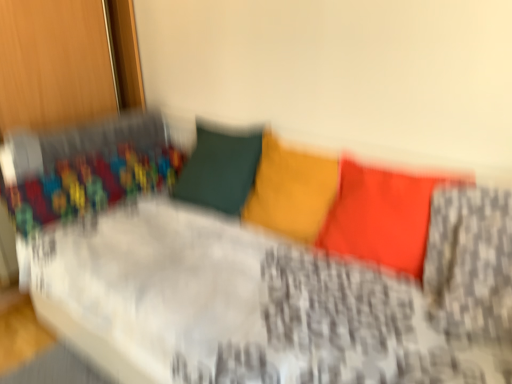
Describe the element at coordinates (291, 191) in the screenshot. I see `matte yellow pillow at center, which ranks as the second pillow in right-to-left order` at that location.

Identify the location of matte yellow pillow at center, placed as the 1th pillow when sorted from left to right. (291, 191).

In order to face matte yellow pillow at center, which ranks as the second pillow in right-to-left order, should I rotate leftwards or rightwards?

To face it directly, rotate right by 4.267 degrees.

In the scene shown: Measure the distance between matte orange pillow at center, the 1th pillow viewed from the right, and camera.

matte orange pillow at center, the 1th pillow viewed from the right, is 4.42 feet from camera.

The width and height of the screenshot is (512, 384). Describe the element at coordinates (382, 216) in the screenshot. I see `matte orange pillow at center, which is counted as the 2th pillow, starting from the left` at that location.

Where is `matte orange pillow at center, which is counted as the 2th pillow, starting from the left`? matte orange pillow at center, which is counted as the 2th pillow, starting from the left is located at coordinates (382, 216).

You are a GUI agent. You are given a task and a screenshot of the screen. Output one action in this format:
    pyautogui.click(x=<x>, y=<y>)
    Task: Click on the matte yellow pillow at center, placed as the 1th pillow when sorted from left to right
    The height and width of the screenshot is (384, 512).
    Given the screenshot: What is the action you would take?
    pyautogui.click(x=291, y=191)

Can you confirm if matte orange pillow at center, the 1th pillow viewed from the right, is positioned to the right of matte yellow pillow at center, placed as the 1th pillow when sorted from left to right?

Correct, you'll find matte orange pillow at center, the 1th pillow viewed from the right, to the right of matte yellow pillow at center, placed as the 1th pillow when sorted from left to right.

Considering the positions of objects matte orange pillow at center, the 1th pillow viewed from the right, and matte yellow pillow at center, placed as the 1th pillow when sorted from left to right, in the image provided, who is behind, matte orange pillow at center, the 1th pillow viewed from the right, or matte yellow pillow at center, placed as the 1th pillow when sorted from left to right,?

matte yellow pillow at center, placed as the 1th pillow when sorted from left to right, is further from the camera.

Which is closer to the camera, (372, 219) or (335, 158)?

Clearly, point (372, 219) is closer to the camera than point (335, 158).

From the image's perspective, is matte orange pillow at center, which is counted as the 2th pillow, starting from the left, over matte yellow pillow at center, placed as the 1th pillow when sorted from left to right?

No, from the image's perspective, matte orange pillow at center, which is counted as the 2th pillow, starting from the left, is not above matte yellow pillow at center, placed as the 1th pillow when sorted from left to right.

From a real-world perspective, which object stands above the other?

matte orange pillow at center, which is counted as the 2th pillow, starting from the left, is physically above.

Considering the sizes of matte orange pillow at center, which is counted as the 2th pillow, starting from the left, and matte yellow pillow at center, placed as the 1th pillow when sorted from left to right, in the image, is matte orange pillow at center, which is counted as the 2th pillow, starting from the left, wider or thinner than matte yellow pillow at center, placed as the 1th pillow when sorted from left to right,?

Clearly, matte orange pillow at center, which is counted as the 2th pillow, starting from the left, has less width compared to matte yellow pillow at center, placed as the 1th pillow when sorted from left to right.

Considering the sizes of matte orange pillow at center, which is counted as the 2th pillow, starting from the left, and matte yellow pillow at center, which ranks as the second pillow in right-to-left order, in the image, is matte orange pillow at center, which is counted as the 2th pillow, starting from the left, taller or shorter than matte yellow pillow at center, which ranks as the second pillow in right-to-left order,?

Considering their sizes, matte orange pillow at center, which is counted as the 2th pillow, starting from the left, has more height than matte yellow pillow at center, which ranks as the second pillow in right-to-left order.

Considering the sizes of objects matte orange pillow at center, which is counted as the 2th pillow, starting from the left, and matte yellow pillow at center, placed as the 1th pillow when sorted from left to right, in the image provided, who is bigger, matte orange pillow at center, which is counted as the 2th pillow, starting from the left, or matte yellow pillow at center, placed as the 1th pillow when sorted from left to right,?

With larger size is matte orange pillow at center, which is counted as the 2th pillow, starting from the left.

Is matte orange pillow at center, the 1th pillow viewed from the right, not within matte yellow pillow at center, placed as the 1th pillow when sorted from left to right?

matte orange pillow at center, the 1th pillow viewed from the right, lies outside matte yellow pillow at center, placed as the 1th pillow when sorted from left to right,'s area.

Does matte orange pillow at center, which is counted as the 2th pillow, starting from the left, touch matte yellow pillow at center, which ranks as the second pillow in right-to-left order?

No, matte orange pillow at center, which is counted as the 2th pillow, starting from the left, is not touching matte yellow pillow at center, which ranks as the second pillow in right-to-left order.

Could you tell me if matte orange pillow at center, which is counted as the 2th pillow, starting from the left, is turned towards matte yellow pillow at center, placed as the 1th pillow when sorted from left to right?

No, matte orange pillow at center, which is counted as the 2th pillow, starting from the left, is not aimed at matte yellow pillow at center, placed as the 1th pillow when sorted from left to right.

Based on the photo, how different are the orientations of matte orange pillow at center, the 1th pillow viewed from the right, and matte yellow pillow at center, placed as the 1th pillow when sorted from left to right, in degrees?

0.369 degrees separate the facing orientations of matte orange pillow at center, the 1th pillow viewed from the right, and matte yellow pillow at center, placed as the 1th pillow when sorted from left to right.

How distant is matte orange pillow at center, which is counted as the 2th pillow, starting from the left, from matte yellow pillow at center, which ranks as the second pillow in right-to-left order?

They are 7.80 inches apart.

Where is `pillow above the matte yellow pillow at center, placed as the 1th pillow when sorted from left to right (from a real-world perspective)`? The width and height of the screenshot is (512, 384). pillow above the matte yellow pillow at center, placed as the 1th pillow when sorted from left to right (from a real-world perspective) is located at coordinates (382, 216).

Visually, is matte yellow pillow at center, placed as the 1th pillow when sorted from left to right, positioned to the left or to the right of matte orange pillow at center, the 1th pillow viewed from the right?

matte yellow pillow at center, placed as the 1th pillow when sorted from left to right, is positioned on matte orange pillow at center, the 1th pillow viewed from the right,'s left side.

Is matte yellow pillow at center, which ranks as the second pillow in right-to-left order, further to the viewer compared to matte orange pillow at center, the 1th pillow viewed from the right?

Yes, matte yellow pillow at center, which ranks as the second pillow in right-to-left order, is further from the viewer.

Does point (284, 168) come farther from viewer compared to point (351, 249)?

Yes.

From the image's perspective, is matte yellow pillow at center, placed as the 1th pillow when sorted from left to right, under matte orange pillow at center, the 1th pillow viewed from the right?

No.

From a real-world perspective, is matte yellow pillow at center, placed as the 1th pillow when sorted from left to right, located higher than matte orange pillow at center, which is counted as the 2th pillow, starting from the left?

Result: No.

Which object is thinner, matte yellow pillow at center, which ranks as the second pillow in right-to-left order, or matte orange pillow at center, the 1th pillow viewed from the right?

matte orange pillow at center, the 1th pillow viewed from the right, is thinner.

Who is taller, matte yellow pillow at center, placed as the 1th pillow when sorted from left to right, or matte orange pillow at center, which is counted as the 2th pillow, starting from the left?

matte orange pillow at center, which is counted as the 2th pillow, starting from the left.

Does matte yellow pillow at center, placed as the 1th pillow when sorted from left to right, have a smaller size compared to matte orange pillow at center, the 1th pillow viewed from the right?

Yes.

Is matte yellow pillow at center, placed as the 1th pillow when sorted from left to right, inside or outside of matte orange pillow at center, the 1th pillow viewed from the right?

matte yellow pillow at center, placed as the 1th pillow when sorted from left to right, lies outside matte orange pillow at center, the 1th pillow viewed from the right.

Is matte yellow pillow at center, placed as the 1th pillow when sorted from left to right, beside matte orange pillow at center, the 1th pillow viewed from the right?

There is a gap between matte yellow pillow at center, placed as the 1th pillow when sorted from left to right, and matte orange pillow at center, the 1th pillow viewed from the right.

Is matte yellow pillow at center, placed as the 1th pillow when sorted from left to right, looking in the opposite direction of matte orange pillow at center, which is counted as the 2th pillow, starting from the left?

No, matte orange pillow at center, which is counted as the 2th pillow, starting from the left, is not at the back of matte yellow pillow at center, placed as the 1th pillow when sorted from left to right.

In order to click on pillow on the right side of matte yellow pillow at center, placed as the 1th pillow when sorted from left to right in this screenshot , I will do `click(382, 216)`.

Identify the location of pillow below the matte orange pillow at center, which is counted as the 2th pillow, starting from the left (from a real-world perspective). (291, 191).

At what (x,y) coordinates should I click in order to perform the action: click on pillow on the right side of matte yellow pillow at center, placed as the 1th pillow when sorted from left to right. Please return your answer as a coordinate pair (x, y). The image size is (512, 384). Looking at the image, I should click on (382, 216).